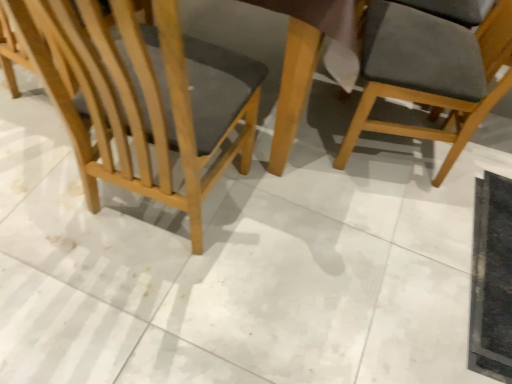
Question: From the image's perspective, is light brown wood chair at left, acting as the 2th chair starting from the right, located above dark gray fabric chair at upper right, the 2th chair positioned from the left?

Choices:
 (A) yes
 (B) no

Answer: (B)

Question: Is there a large distance between light brown wood chair at left, arranged as the first chair when viewed from the left, and dark gray fabric chair at upper right, marked as the 1th chair in a right-to-left arrangement?

Choices:
 (A) yes
 (B) no

Answer: (B)

Question: Does light brown wood chair at left, arranged as the first chair when viewed from the left, appear on the right side of dark gray fabric chair at upper right, marked as the 1th chair in a right-to-left arrangement?

Choices:
 (A) yes
 (B) no

Answer: (B)

Question: Is light brown wood chair at left, arranged as the first chair when viewed from the left, facing towards dark gray fabric chair at upper right, marked as the 1th chair in a right-to-left arrangement?

Choices:
 (A) yes
 (B) no

Answer: (B)

Question: Is light brown wood chair at left, acting as the 2th chair starting from the right, to the left of dark gray fabric chair at upper right, marked as the 1th chair in a right-to-left arrangement, from the viewer's perspective?

Choices:
 (A) no
 (B) yes

Answer: (B)

Question: Is light brown wood chair at left, acting as the 2th chair starting from the right, in front of dark gray fabric chair at upper right, the 2th chair positioned from the left?

Choices:
 (A) no
 (B) yes

Answer: (B)

Question: Would you say dark gray fabric chair at upper right, the 2th chair positioned from the left, is outside light brown wood chair at left, arranged as the first chair when viewed from the left?

Choices:
 (A) no
 (B) yes

Answer: (B)

Question: From the image's perspective, is dark gray fabric chair at upper right, marked as the 1th chair in a right-to-left arrangement, located beneath light brown wood chair at left, arranged as the first chair when viewed from the left?

Choices:
 (A) yes
 (B) no

Answer: (B)

Question: Could you tell me if dark gray fabric chair at upper right, marked as the 1th chair in a right-to-left arrangement, is facing light brown wood chair at left, acting as the 2th chair starting from the right?

Choices:
 (A) yes
 (B) no

Answer: (B)

Question: Is dark gray fabric chair at upper right, the 2th chair positioned from the left, beside light brown wood chair at left, acting as the 2th chair starting from the right?

Choices:
 (A) no
 (B) yes

Answer: (A)

Question: From the image's perspective, is dark gray fabric chair at upper right, marked as the 1th chair in a right-to-left arrangement, located above light brown wood chair at left, acting as the 2th chair starting from the right?

Choices:
 (A) yes
 (B) no

Answer: (A)

Question: Is dark gray fabric chair at upper right, marked as the 1th chair in a right-to-left arrangement, surrounding light brown wood chair at left, acting as the 2th chair starting from the right?

Choices:
 (A) no
 (B) yes

Answer: (A)

Question: Considering their positions, is light brown wood chair at left, arranged as the first chair when viewed from the left, located in front of or behind dark gray fabric chair at upper right, the 2th chair positioned from the left?

Choices:
 (A) behind
 (B) front

Answer: (B)